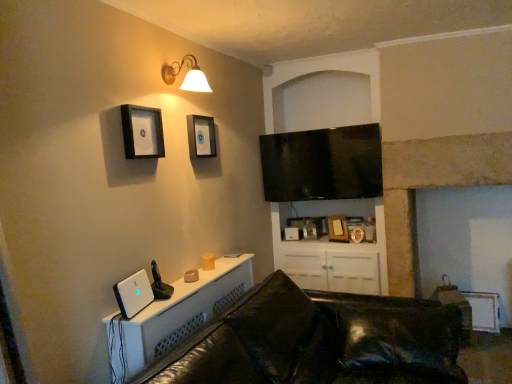
Question: Considering the relative sizes of white plastic desktop computer at lower left and black leather couch at lower center in the image provided, is white plastic desktop computer at lower left smaller than black leather couch at lower center?

Choices:
 (A) no
 (B) yes

Answer: (B)

Question: Is white plastic desktop computer at lower left completely or partially outside of black leather couch at lower center?

Choices:
 (A) yes
 (B) no

Answer: (A)

Question: Is white plastic desktop computer at lower left in contact with black leather couch at lower center?

Choices:
 (A) no
 (B) yes

Answer: (A)

Question: Is white plastic desktop computer at lower left at the left side of black leather couch at lower center?

Choices:
 (A) no
 (B) yes

Answer: (B)

Question: Is black leather couch at lower center at the back of white plastic desktop computer at lower left?

Choices:
 (A) yes
 (B) no

Answer: (B)

Question: Is black leather couch at lower center inside white plastic desktop computer at lower left?

Choices:
 (A) no
 (B) yes

Answer: (A)

Question: From a real-world perspective, is black glossy flat-screen tv at upper center under matte gold wall sconce at upper center?

Choices:
 (A) yes
 (B) no

Answer: (A)

Question: Is black glossy flat-screen tv at upper center located outside matte gold wall sconce at upper center?

Choices:
 (A) yes
 (B) no

Answer: (A)

Question: Is matte gold wall sconce at upper center surrounded by black glossy flat-screen tv at upper center?

Choices:
 (A) no
 (B) yes

Answer: (A)

Question: Can you confirm if black glossy flat-screen tv at upper center is wider than matte gold wall sconce at upper center?

Choices:
 (A) yes
 (B) no

Answer: (B)

Question: Is black glossy flat-screen tv at upper center smaller than matte gold wall sconce at upper center?

Choices:
 (A) no
 (B) yes

Answer: (A)

Question: From the image's perspective, is black glossy flat-screen tv at upper center under matte gold wall sconce at upper center?

Choices:
 (A) yes
 (B) no

Answer: (A)

Question: Is wooden picture frame at center, the 3th picture frame positioned from the top, oriented towards matte black picture frame at upper center, the third picture frame when ordered from right to left?

Choices:
 (A) yes
 (B) no

Answer: (B)